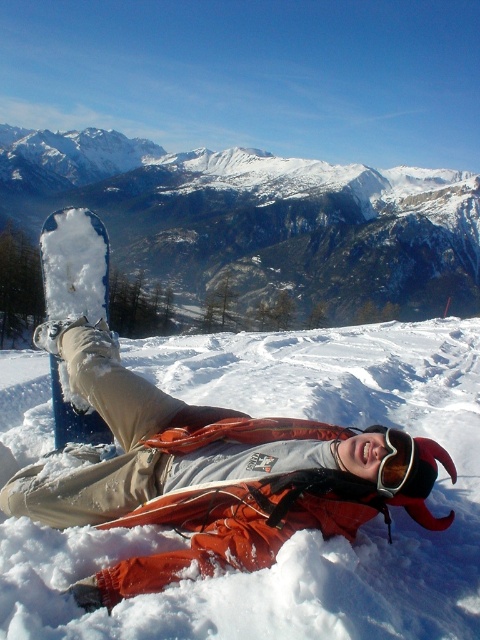
You are a photographer trying to capture the snowboard and goggles in the scene. Since the white snowboard at upper left and transparent plastic goggles at upper center are both in your frame, which object will appear bigger in your photo?

The white snowboard at upper left is larger in size than transparent plastic goggles at upper center, so it will appear bigger in the photo.

You are planning to build a snowman using the white fluffy snow at lower center and the white snowboard at upper left. Which material would be better for forming the snowman base?

The white snowboard at upper left is better for forming the snowman base because the white fluffy snow at lower center is thinner and may not hold the shape as well.

You are a photographer trying to capture the snowboarder in the scene. You notice the white fluffy snow at lower center and the transparent plastic goggles at upper center. Which object should you focus on if you want to highlight something larger in the frame?

The white fluffy snow at lower center should be focused on because it has a larger size compared to the transparent plastic goggles at upper center.